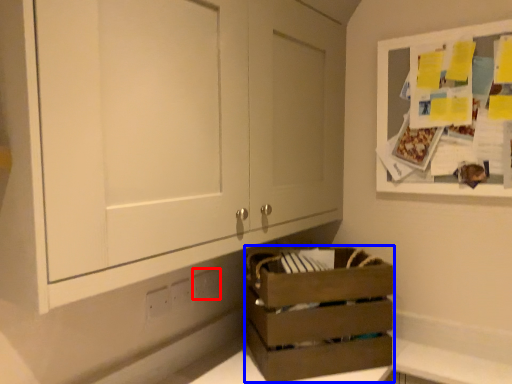
Question: Which object is further to the camera taking this photo, electric outlet (highlighted by a red box) or crate (highlighted by a blue box)?

Choices:
 (A) electric outlet
 (B) crate

Answer: (A)